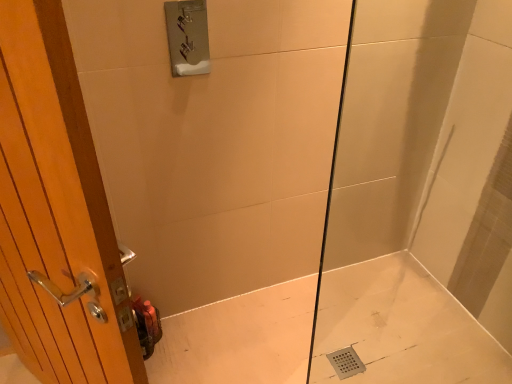
Question: Based on their sizes in the image, would you say white glossy bath at lower right is bigger or smaller than wooden door at left?

Choices:
 (A) small
 (B) big

Answer: (A)

Question: Visually, is white glossy bath at lower right positioned to the left or to the right of wooden door at left?

Choices:
 (A) right
 (B) left

Answer: (A)

Question: Estimate the real-world distances between objects in this image. Which object is farther from the white glossy bath at lower right?

Choices:
 (A) wooden door at left
 (B) transparent glass shower door at center

Answer: (A)

Question: Which is farther from the white glossy bath at lower right?

Choices:
 (A) transparent glass shower door at center
 (B) wooden door at left

Answer: (B)